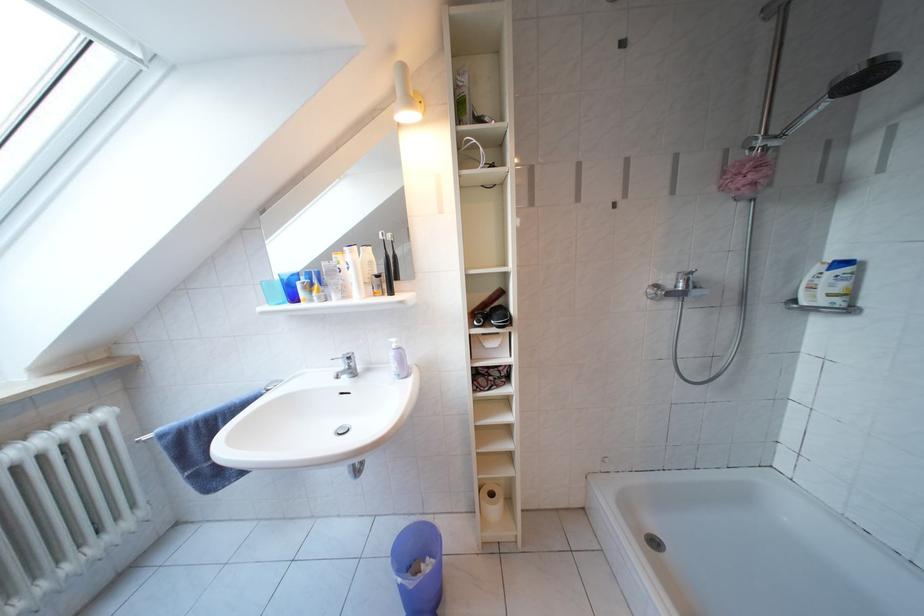
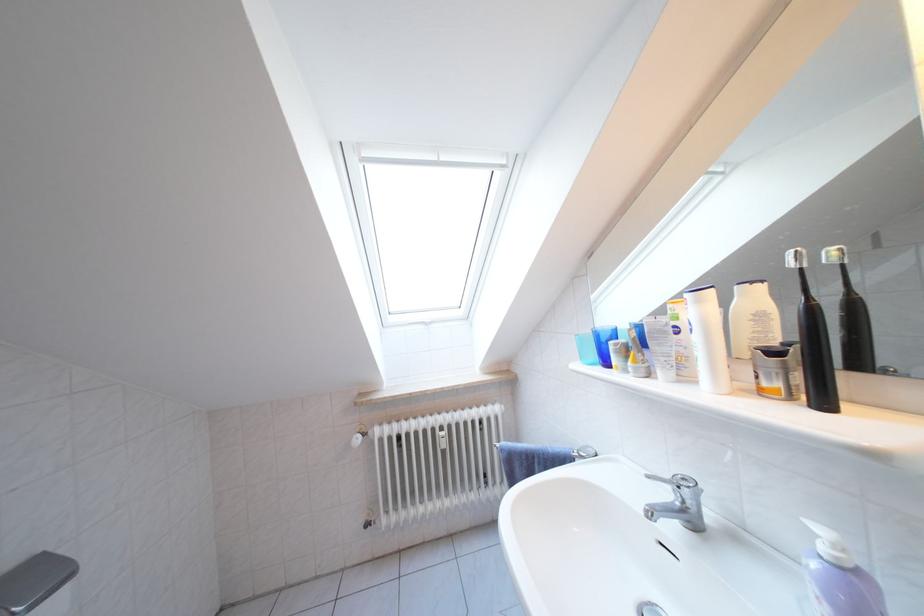
Locate, in the second image, the point that corresponds to (x=386, y=281) in the first image.

(783, 359)